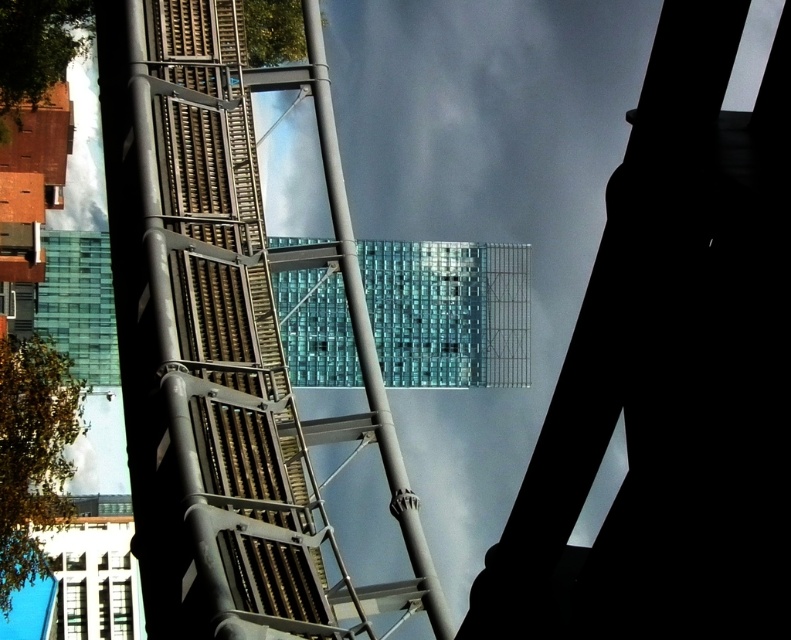
Is translucent glass tower at center thinner than metallic gray pole at center?

Incorrect, translucent glass tower at center's width is not less than metallic gray pole at center's.

I want to click on translucent glass tower at center, so click(226, 340).

Is point (148, 362) farther from viewer compared to point (380, 385)?

No, it is in front of (380, 385).

This screenshot has height=640, width=791. I want to click on translucent glass tower at center, so click(x=226, y=340).